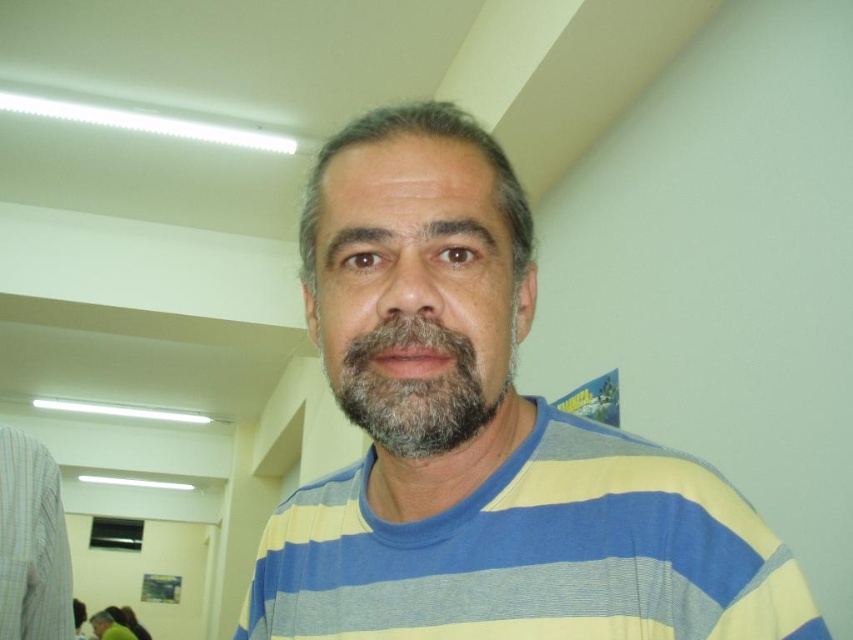
The width and height of the screenshot is (853, 640). Identify the location of graywoollybeard at center. (415, 388).

Who is more distant from viewer, (415, 403) or (96, 630)?

Point (96, 630)

You are a GUI agent. You are given a task and a screenshot of the screen. Output one action in this format:
    pyautogui.click(x=<x>, y=<y>)
    Task: Click on the graywoollybeard at center
    
    Given the screenshot: What is the action you would take?
    pyautogui.click(x=415, y=388)

Looking at this image, can you confirm if yellow-blue striped t-shirt at center is bigger than graywoollybeard at center?

Yes, yellow-blue striped t-shirt at center is bigger than graywoollybeard at center.

Who is shorter, yellow-blue striped t-shirt at center or graywoollybeard at center?

graywoollybeard at center

Is point (566, 506) farther from camera compared to point (424, 440)?

Yes, point (566, 506) is behind point (424, 440).

You are a GUI agent. You are given a task and a screenshot of the screen. Output one action in this format:
    pyautogui.click(x=<x>, y=<y>)
    Task: Click on the yellow-blue striped t-shirt at center
    This screenshot has height=640, width=853.
    Given the screenshot: What is the action you would take?
    pyautogui.click(x=532, y=554)

Is yellow-blue striped shirt at center to the right of yellow-blue striped t-shirt at center from the viewer's perspective?

Yes, yellow-blue striped shirt at center is to the right of yellow-blue striped t-shirt at center.

Is point (691, 588) positioned behind point (647, 624)?

No, (691, 588) is closer to viewer.

Image resolution: width=853 pixels, height=640 pixels. Identify the location of yellow-blue striped shirt at center. (482, 436).